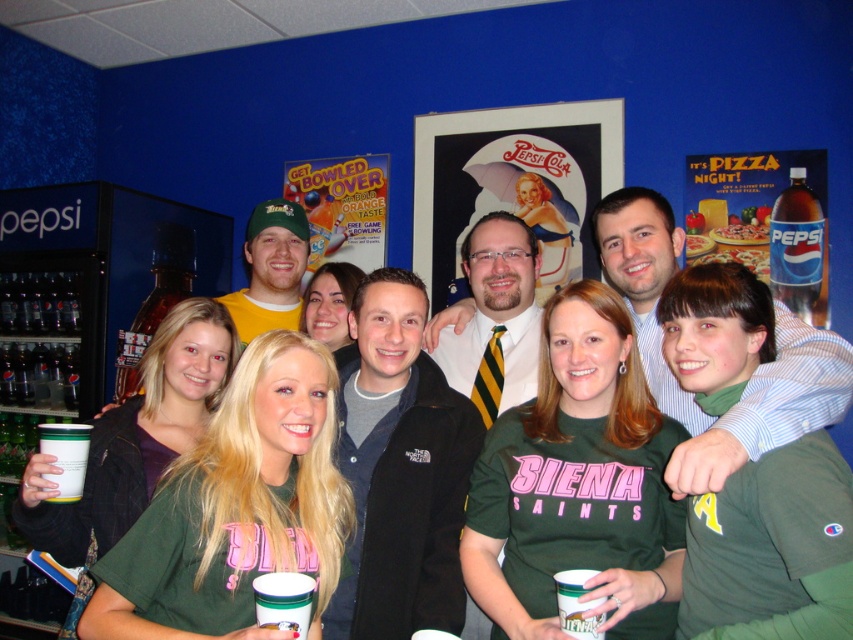
Which is behind, point (799, 246) or point (76, 381)?

The point (76, 381) is more distant.

Who is lower down, translucent plastic bottle at upper right or translucent plastic cup at lower left?

translucent plastic cup at lower left is below.

I want to click on translucent plastic bottle at upper right, so click(x=796, y=246).

Which is below, striped tie at center or white paper cup at lower left?

white paper cup at lower left is lower down.

Who is more forward, (494, 256) or (59, 497)?

Positioned in front is point (59, 497).

Identify the location of striped tie at center. The width and height of the screenshot is (853, 640). (495, 317).

Is point (798, 397) in front of point (273, 202)?

Yes.

In the scene shown: Does white shirt at center have a larger size compared to yellow t-shirt at center?

No.

Consider the image. Measure the distance between white shirt at center and camera.

They are 1.90 meters apart.

The width and height of the screenshot is (853, 640). In order to click on white shirt at center in this screenshot , I will do coord(750,380).